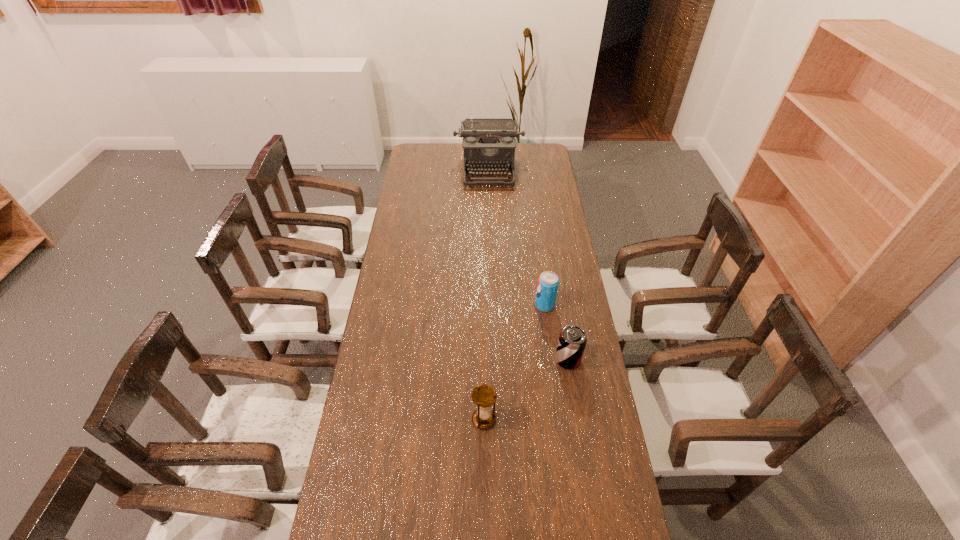
Find the location of a particular element. The height and width of the screenshot is (540, 960). vacant space that is in between the nearer soda can and the farther soda can is located at coordinates (557, 333).

Find the location of a particular element. This screenshot has width=960, height=540. vacant area between the nearest object and the third farthest object is located at coordinates (526, 389).

At what (x,y) coordinates should I click in order to perform the action: click on the third closest object to the nearest object. Please return your answer as a coordinate pair (x, y). The image size is (960, 540). Looking at the image, I should click on (489, 143).

Point out which object is positioned as the second nearest to the farther soda can. Please provide its 2D coordinates. Your answer should be formatted as a tuple, i.e. [(x, y)], where the tuple contains the x and y coordinates of a point satisfying the conditions above.

[(484, 396)]

Identify which soda can is located as the nearest to the typewriter. Please provide its 2D coordinates. Your answer should be formatted as a tuple, i.e. [(x, y)], where the tuple contains the x and y coordinates of a point satisfying the conditions above.

[(548, 282)]

Where is `vacant space that satisfies the following two spatial constraints: 1. on the typing side of the farther soda can; 2. on the right side of the tallest object`? This screenshot has height=540, width=960. vacant space that satisfies the following two spatial constraints: 1. on the typing side of the farther soda can; 2. on the right side of the tallest object is located at coordinates (492, 305).

Identify the location of free location that satisfies the following two spatial constraints: 1. on the typing side of the farther soda can; 2. on the left side of the tallest object. The image size is (960, 540). (492, 305).